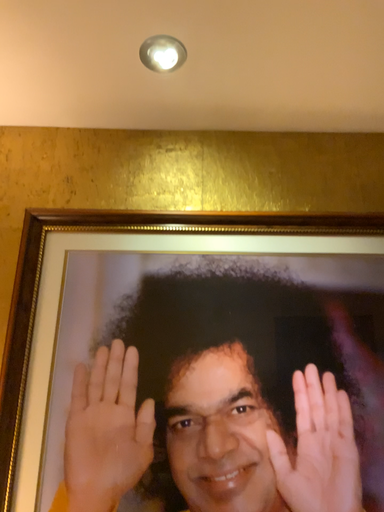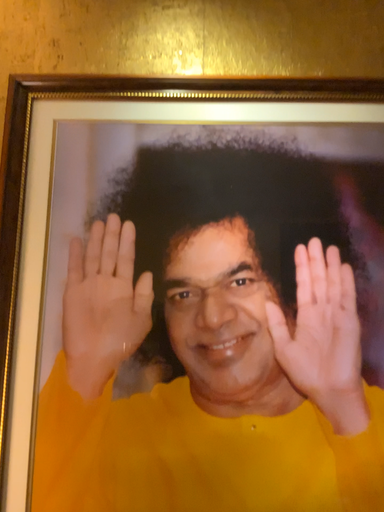
Question: Which way did the camera rotate in the video?

Choices:
 (A) rotated downward
 (B) rotated upward

Answer: (A)